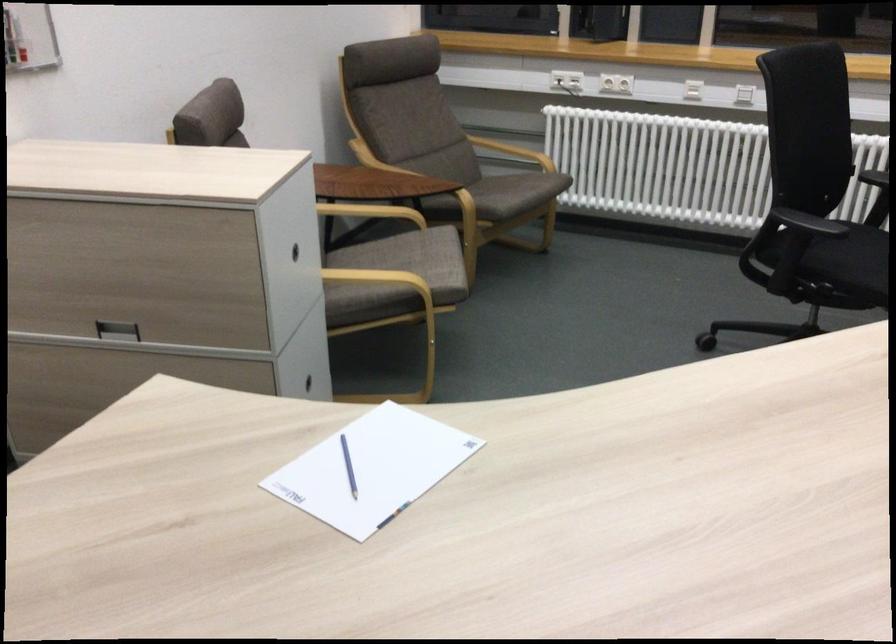
Find where to pull the recessed drawer handle. Please return your answer as a coordinate pair (x, y).

(116, 330)